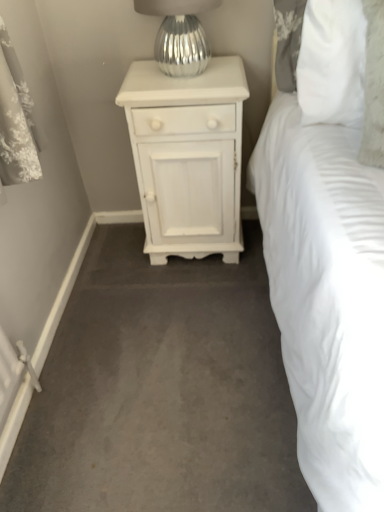
Identify the location of white painted wood nightstand at center. This screenshot has width=384, height=512. (188, 157).

Identify the location of white painted wood nightstand at center. This screenshot has width=384, height=512. (188, 157).

Does silver metallic vase at upper center appear on the left side of white painted wood nightstand at center?

Yes, silver metallic vase at upper center is to the left of white painted wood nightstand at center.

From the image's perspective, which object appears higher, silver metallic vase at upper center or white painted wood nightstand at center?

silver metallic vase at upper center.

Considering the positions of objects silver metallic vase at upper center and smooth gray carpet at center in the image provided, who is behind, silver metallic vase at upper center or smooth gray carpet at center?

silver metallic vase at upper center is further from the camera.

What are the coordinates of `concrete that appears on the right of silver metallic vase at upper center` in the screenshot? It's located at (161, 390).

Considering the sizes of objects silver metallic vase at upper center and smooth gray carpet at center in the image provided, who is bigger, silver metallic vase at upper center or smooth gray carpet at center?

With larger size is smooth gray carpet at center.

Which object is positioned more to the right, silver metallic vase at upper center or smooth gray carpet at center?

smooth gray carpet at center.

From the image's perspective, is white painted wood nightstand at center over silver metallic vase at upper center?

No, from the image's perspective, white painted wood nightstand at center is not on top of silver metallic vase at upper center.

I want to click on nightstand below the silver metallic vase at upper center (from the image's perspective), so click(188, 157).

Looking at this image, which of these two, white painted wood nightstand at center or silver metallic vase at upper center, is wider?

white painted wood nightstand at center.

Is white painted wood nightstand at center bigger than silver metallic vase at upper center?

Correct, white painted wood nightstand at center is larger in size than silver metallic vase at upper center.

Which is correct: smooth gray carpet at center is inside white painted wood nightstand at center, or outside of it?

smooth gray carpet at center is outside white painted wood nightstand at center.

Is smooth gray carpet at center oriented away from white painted wood nightstand at center?

No, smooth gray carpet at center's orientation is not away from white painted wood nightstand at center.

Is point (268, 509) closer or farther from the camera than point (216, 153)?

Point (268, 509) appears to be closer to the viewer than point (216, 153).

Which of these two, smooth gray carpet at center or white painted wood nightstand at center, is thinner?

With smaller width is white painted wood nightstand at center.

Between smooth gray carpet at center and silver metallic vase at upper center, which one has more height?

With more height is silver metallic vase at upper center.

Between point (185, 394) and point (167, 6), which one is positioned behind?

Positioned behind is point (167, 6).

Is smooth gray carpet at center looking in the opposite direction of silver metallic vase at upper center?

No, smooth gray carpet at center is not facing away from silver metallic vase at upper center.

Considering the relative positions of smooth gray carpet at center and silver metallic vase at upper center in the image provided, is smooth gray carpet at center to the left or to the right of silver metallic vase at upper center?

smooth gray carpet at center is positioned on silver metallic vase at upper center's right side.

Considering the sizes of objects white painted wood nightstand at center and smooth gray carpet at center in the image provided, who is wider, white painted wood nightstand at center or smooth gray carpet at center?

With larger width is smooth gray carpet at center.

Is point (230, 152) more distant than point (255, 391)?

Yes, it is.

Between white painted wood nightstand at center and smooth gray carpet at center, which one has smaller size?

Smaller between the two is smooth gray carpet at center.

Can you confirm if white painted wood nightstand at center is taller than smooth gray carpet at center?

Indeed, white painted wood nightstand at center has a greater height compared to smooth gray carpet at center.

Image resolution: width=384 pixels, height=512 pixels. I want to click on table lamp in front of the white painted wood nightstand at center, so click(179, 35).

The height and width of the screenshot is (512, 384). Identify the location of table lamp positioned vertically above the smooth gray carpet at center (from a real-world perspective). (179, 35).

Estimate the real-world distances between objects in this image. Which object is further from smooth gray carpet at center, white painted wood nightstand at center or silver metallic vase at upper center?

The object further to smooth gray carpet at center is silver metallic vase at upper center.

Considering their positions, is smooth gray carpet at center positioned further to white painted wood nightstand at center than silver metallic vase at upper center?

Based on the image, smooth gray carpet at center appears to be further to white painted wood nightstand at center.

Which object lies nearer to the anchor point smooth gray carpet at center, silver metallic vase at upper center or white painted wood nightstand at center?

white painted wood nightstand at center is closer to smooth gray carpet at center.

When comparing their distances from silver metallic vase at upper center, does white painted wood nightstand at center or smooth gray carpet at center seem closer?

white painted wood nightstand at center lies closer to silver metallic vase at upper center than the other object.

Considering their positions, is silver metallic vase at upper center positioned closer to white painted wood nightstand at center than smooth gray carpet at center?

silver metallic vase at upper center lies closer to white painted wood nightstand at center than the other object.

Based on their spatial positions, is smooth gray carpet at center or white painted wood nightstand at center closer to silver metallic vase at upper center?

The object closer to silver metallic vase at upper center is white painted wood nightstand at center.

Find the location of a particular element. Image resolution: width=384 pixels, height=512 pixels. nightstand that lies between silver metallic vase at upper center and smooth gray carpet at center from top to bottom is located at coordinates (188, 157).